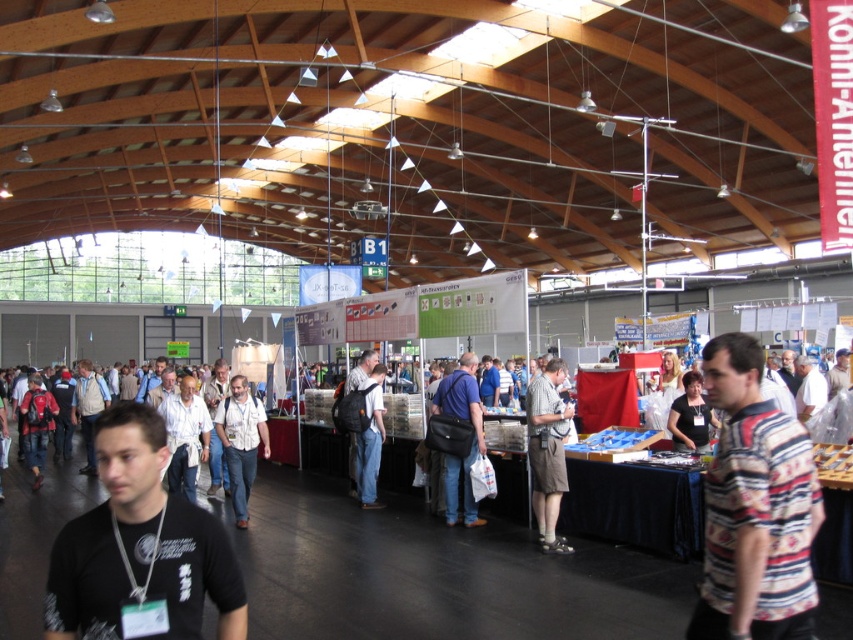
You are a fashion designer observing the indoor exhibition hall. You notice the gray cotton shirt at center and dark blue jeans at center. Which item has a greater width?

The gray cotton shirt at center has a greater width than the dark blue jeans at center according to the description.

You are a photographer who needs to capture a photo of the striped cotton shirt at center without getting too close. Your camera has a maximum zoom range of 2 meters. Can you take the photo from your current position?

The striped cotton shirt at center and camera are 2.83 meters apart, so the camera is beyond the maximum zoom range of 2 meters. You cannot take the photo from your current position.

You are a customer in the exhibition hall and you see the striped cotton shirt at center and the dark blue jeans at center. Which item is located higher up?

The striped cotton shirt at center is above dark blue jeans at center, so the striped cotton shirt at center is higher up.